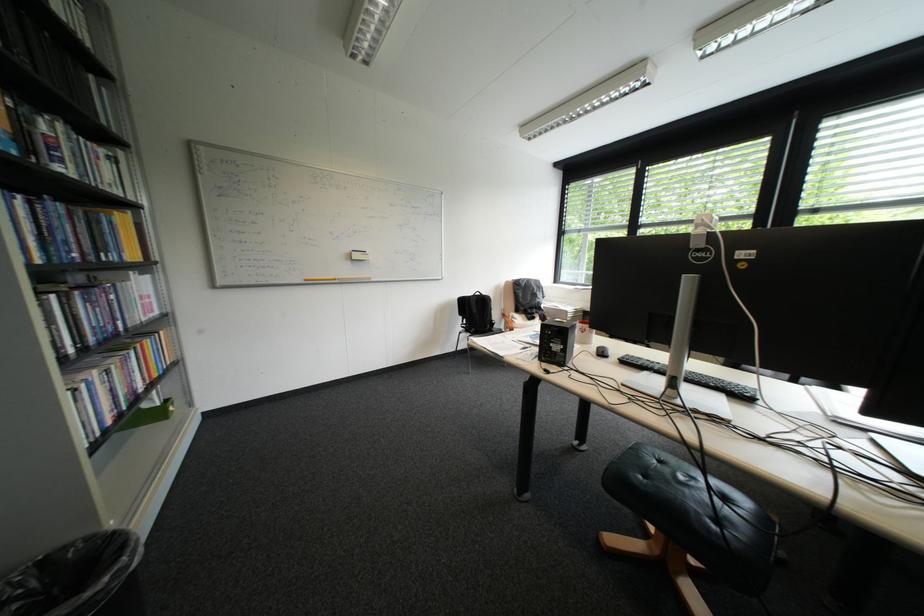
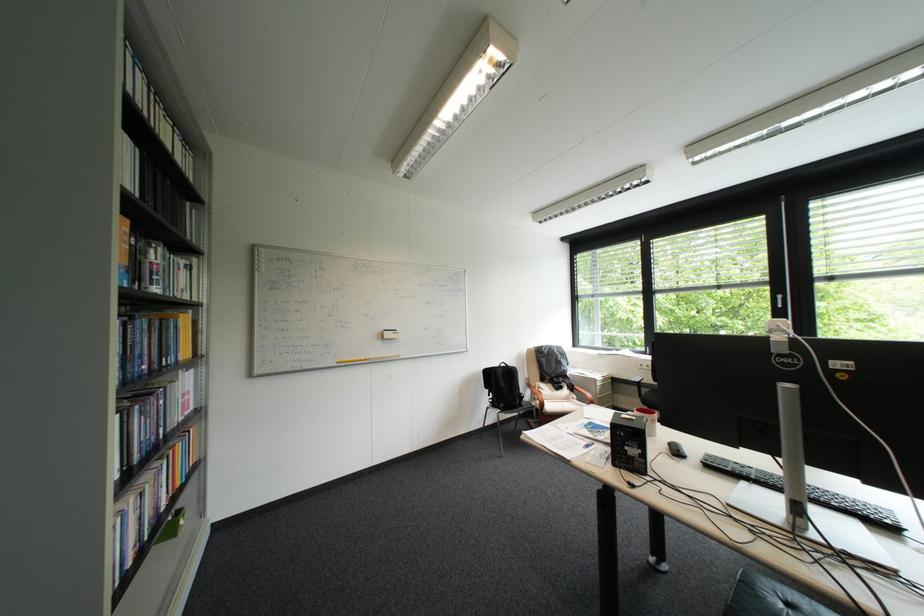
The point at (611, 349) is marked in the first image. Where is the corresponding point in the second image?

(682, 445)